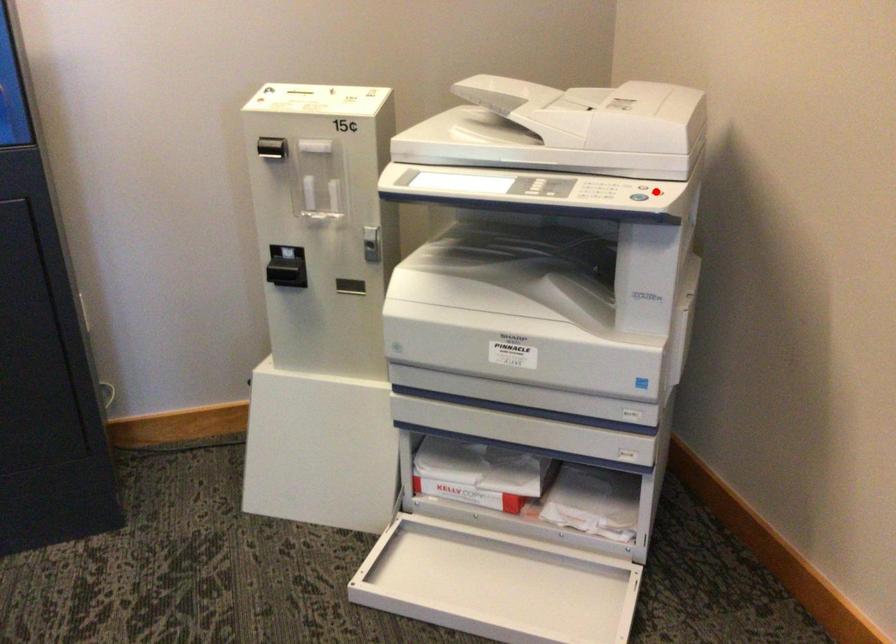
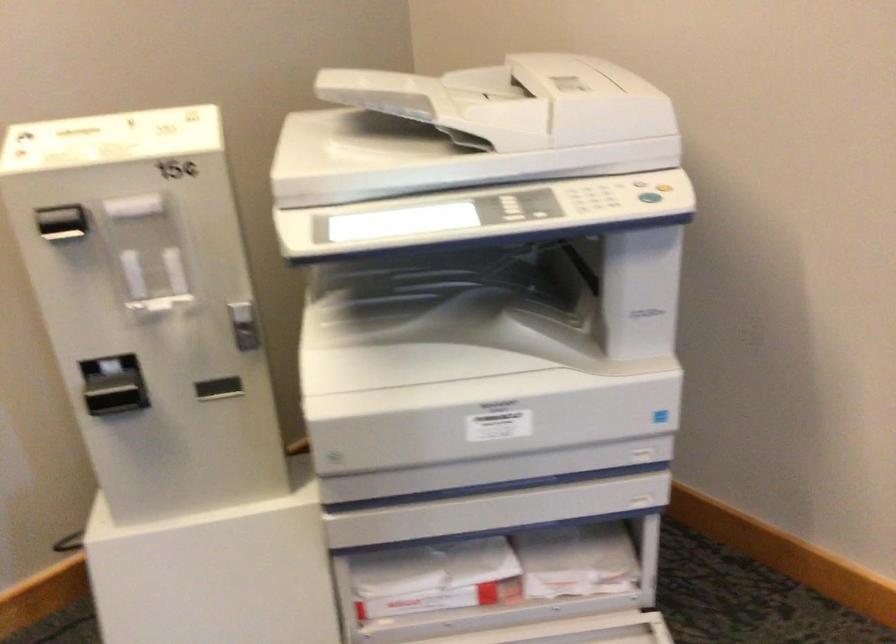
Question: I am providing you with two images of the same scene from different viewpoints. A red point is shown in image1. For the corresponding object point in image2, is it positioned nearer or farther from the camera?

Choices:
 (A) Nearer
 (B) Farther

Answer: (A)